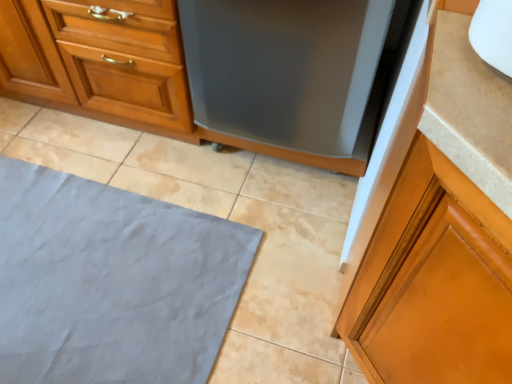
Find the location of a particular element. The width and height of the screenshot is (512, 384). wooden cabinet at center, arranged as the 2th cabinetry when viewed from the right is located at coordinates (98, 61).

What do you see at coordinates (440, 229) in the screenshot? I see `glossy wood cabinet at right, the first cabinetry positioned from the front` at bounding box center [440, 229].

Measure the distance between gray fabric bath mat at lower left and camera.

gray fabric bath mat at lower left and camera are 1.11 meters apart from each other.

I want to click on satin black dishwasher at center, so click(295, 74).

You are a GUI agent. You are given a task and a screenshot of the screen. Output one action in this format:
    pyautogui.click(x=<x>, y=<y>)
    Task: Click on the cabinetry in front of the gray fabric bath mat at lower left
    This screenshot has width=512, height=384.
    Given the screenshot: What is the action you would take?
    pyautogui.click(x=440, y=229)

From the image's perspective, is glossy wood cabinet at right, which is the 2th cabinetry from left to right, located beneath gray fabric bath mat at lower left?

Yes, from the image's perspective, glossy wood cabinet at right, which is the 2th cabinetry from left to right, is below gray fabric bath mat at lower left.

Looking at this image, from a real-world perspective, which object stands above the other?

From a 3D spatial view, glossy wood cabinet at right, placed as the 2th cabinetry when sorted from top to bottom, is above.

Could gray fabric bath mat at lower left be considered to be inside glossy wood cabinet at right, which is the 2th cabinetry from left to right?

No, gray fabric bath mat at lower left is not inside glossy wood cabinet at right, which is the 2th cabinetry from left to right.

From a real-world perspective, is glossy wood cabinet at right, the second cabinetry from the back, physically above wooden cabinet at center, the 1th cabinetry viewed from the back?

Yes.

Which object is closer to the camera taking this photo, glossy wood cabinet at right, the first cabinetry positioned from the front, or wooden cabinet at center, acting as the first cabinetry starting from the top?

Positioned in front is glossy wood cabinet at right, the first cabinetry positioned from the front.

Consider the image. Which point is more distant from viewer, (507, 294) or (101, 114)?

The point (101, 114) is behind.

Looking at this image, which of these two, glossy wood cabinet at right, positioned as the 1th cabinetry in right-to-left order, or wooden cabinet at center, which appears as the 1th cabinetry when viewed from the left, stands shorter?

wooden cabinet at center, which appears as the 1th cabinetry when viewed from the left.

Could you tell me if satin black dishwasher at center is facing gray fabric bath mat at lower left?

Yes.

Between satin black dishwasher at center and gray fabric bath mat at lower left, which one has larger width?

gray fabric bath mat at lower left.

From the image's perspective, is satin black dishwasher at center on top of gray fabric bath mat at lower left?

Yes, from the image's perspective, satin black dishwasher at center is above gray fabric bath mat at lower left.

Does satin black dishwasher at center appear on the left side of gray fabric bath mat at lower left?

In fact, satin black dishwasher at center is to the right of gray fabric bath mat at lower left.

Considering the positions of objects glossy wood cabinet at right, which is the 2th cabinetry from left to right, and satin black dishwasher at center in the image provided, who is more to the right, glossy wood cabinet at right, which is the 2th cabinetry from left to right, or satin black dishwasher at center?

From the viewer's perspective, glossy wood cabinet at right, which is the 2th cabinetry from left to right, appears more on the right side.

From a real-world perspective, is glossy wood cabinet at right, the second cabinetry from the back, located beneath satin black dishwasher at center?

No.

Which is closer to the camera, (468,374) or (287,18)?

Point (468,374).

Considering the sizes of objects glossy wood cabinet at right, positioned as the 1th cabinetry in right-to-left order, and satin black dishwasher at center in the image provided, who is taller, glossy wood cabinet at right, positioned as the 1th cabinetry in right-to-left order, or satin black dishwasher at center?

With more height is glossy wood cabinet at right, positioned as the 1th cabinetry in right-to-left order.

Is gray fabric bath mat at lower left positioned with its back to satin black dishwasher at center?

gray fabric bath mat at lower left is not turned away from satin black dishwasher at center.

Which of these two, gray fabric bath mat at lower left or satin black dishwasher at center, is thinner?

satin black dishwasher at center.

Where is `bath mat below the satin black dishwasher at center (from the image's perspective)`? The image size is (512, 384). bath mat below the satin black dishwasher at center (from the image's perspective) is located at coordinates (111, 282).

From a real-world perspective, is gray fabric bath mat at lower left below wooden cabinet at center, the second cabinetry when ordered from bottom to top?

Yes, from a real-world perspective, gray fabric bath mat at lower left is below wooden cabinet at center, the second cabinetry when ordered from bottom to top.

Is gray fabric bath mat at lower left positioned before wooden cabinet at center, acting as the first cabinetry starting from the top?

Yes, gray fabric bath mat at lower left is closer to the camera.

In the scene shown: From the image's perspective, which is above, gray fabric bath mat at lower left or wooden cabinet at center, acting as the first cabinetry starting from the top?

wooden cabinet at center, acting as the first cabinetry starting from the top, appears higher in the image.

From the picture: Can we say gray fabric bath mat at lower left lies outside wooden cabinet at center, which appears as the 1th cabinetry when viewed from the left?

Yes, gray fabric bath mat at lower left is outside of wooden cabinet at center, which appears as the 1th cabinetry when viewed from the left.

Which object is wider, gray fabric bath mat at lower left or glossy wood cabinet at right, positioned as the 1th cabinetry in right-to-left order?

With larger width is gray fabric bath mat at lower left.

Can glossy wood cabinet at right, positioned as the 1th cabinetry in right-to-left order, be found inside gray fabric bath mat at lower left?

No, glossy wood cabinet at right, positioned as the 1th cabinetry in right-to-left order, is not surrounded by gray fabric bath mat at lower left.

Considering the points (30, 349) and (407, 283), which point is in front, point (30, 349) or point (407, 283)?

The point (407, 283) is closer to the camera.

Which object is positioned more to the left, gray fabric bath mat at lower left or glossy wood cabinet at right, placed as the 2th cabinetry when sorted from top to bottom?

From the viewer's perspective, gray fabric bath mat at lower left appears more on the left side.

From a real-world perspective, starting from the gray fabric bath mat at lower left, which cabinetry is the 2nd one vertically above it? Please provide its 2D coordinates.

[(440, 229)]

Locate an element on the screen. cabinetry on the left of glossy wood cabinet at right, the second cabinetry from the back is located at coordinates (98, 61).

Looking at the image, which one is located closer to wooden cabinet at center, acting as the first cabinetry starting from the top, satin black dishwasher at center or glossy wood cabinet at right, placed as the 2th cabinetry when sorted from top to bottom?

satin black dishwasher at center lies closer to wooden cabinet at center, acting as the first cabinetry starting from the top, than the other object.

Estimate the real-world distances between objects in this image. Which object is further from gray fabric bath mat at lower left, satin black dishwasher at center or glossy wood cabinet at right, which is the 2th cabinetry from left to right?

glossy wood cabinet at right, which is the 2th cabinetry from left to right.

Looking at the image, which one is located closer to glossy wood cabinet at right, which is the 2th cabinetry from left to right, satin black dishwasher at center or wooden cabinet at center, which appears as the 1th cabinetry when viewed from the left?

satin black dishwasher at center is closer to glossy wood cabinet at right, which is the 2th cabinetry from left to right.

Looking at the image, which one is located closer to wooden cabinet at center, arranged as the 2th cabinetry when viewed from the right, glossy wood cabinet at right, positioned as the 1th cabinetry in right-to-left order, or satin black dishwasher at center?

Among the two, satin black dishwasher at center is located nearer to wooden cabinet at center, arranged as the 2th cabinetry when viewed from the right.

Estimate the real-world distances between objects in this image. Which object is closer to satin black dishwasher at center, glossy wood cabinet at right, which is the 2th cabinetry from left to right, or wooden cabinet at center, arranged as the 2th cabinetry when viewed from the right?

The object closer to satin black dishwasher at center is wooden cabinet at center, arranged as the 2th cabinetry when viewed from the right.

Which object lies further to the anchor point gray fabric bath mat at lower left, glossy wood cabinet at right, which is the 2th cabinetry from left to right, or satin black dishwasher at center?

glossy wood cabinet at right, which is the 2th cabinetry from left to right, is further to gray fabric bath mat at lower left.

Considering their positions, is satin black dishwasher at center positioned further to glossy wood cabinet at right, the second cabinetry from the back, than gray fabric bath mat at lower left?

gray fabric bath mat at lower left lies further to glossy wood cabinet at right, the second cabinetry from the back, than the other object.

Estimate the real-world distances between objects in this image. Which object is further from satin black dishwasher at center, wooden cabinet at center, arranged as the 2th cabinetry when viewed from the right, or gray fabric bath mat at lower left?

The object further to satin black dishwasher at center is gray fabric bath mat at lower left.

Locate an element on the screen. appliance between wooden cabinet at center, the second cabinetry when ordered from bottom to top, and gray fabric bath mat at lower left from top to bottom is located at coordinates (295, 74).

Locate an element on the screen. The height and width of the screenshot is (384, 512). bath mat between wooden cabinet at center, the 2th cabinetry from the front, and glossy wood cabinet at right, placed as the 2th cabinetry when sorted from top to bottom is located at coordinates (111, 282).

What are the coordinates of `appliance between wooden cabinet at center, the 2th cabinetry from the front, and glossy wood cabinet at right, which is the 2th cabinetry from left to right, in the horizontal direction` in the screenshot? It's located at (295, 74).

This screenshot has width=512, height=384. I want to click on appliance between gray fabric bath mat at lower left and glossy wood cabinet at right, which is the 2th cabinetry from left to right, from left to right, so click(295, 74).